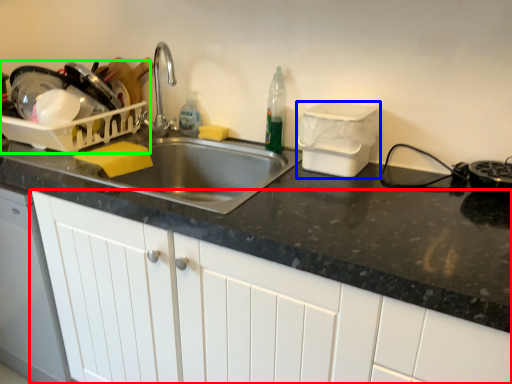
Question: Which is nearer to the cabinetry (highlighted by a red box)? appliance (highlighted by a blue box) or appliance (highlighted by a green box).

Choices:
 (A) appliance
 (B) appliance

Answer: (A)